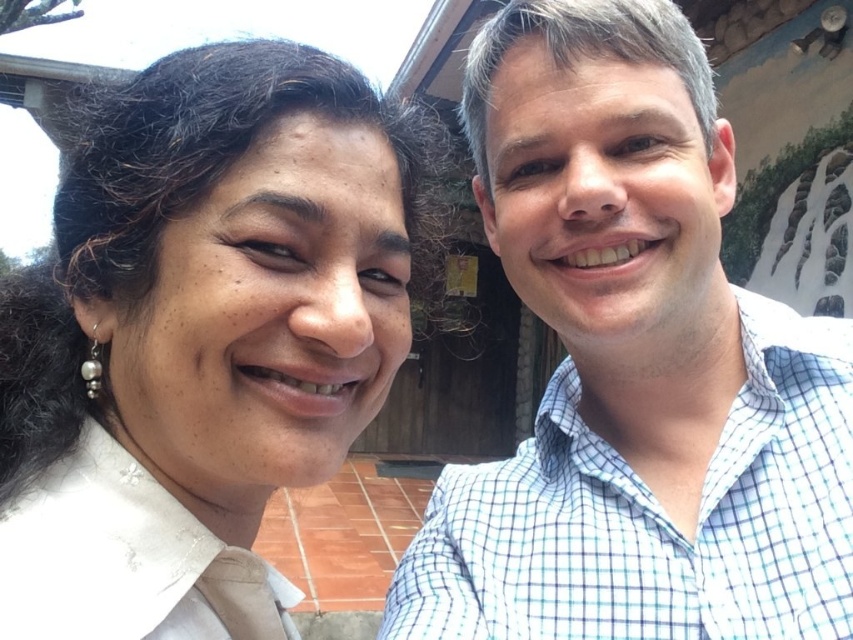
Question: Which point is farther to the camera?

Choices:
 (A) white matte shirt at upper left
 (B) white checkered shirt at right

Answer: (B)

Question: Is white checkered shirt at right positioned behind white matte shirt at upper left?

Choices:
 (A) no
 (B) yes

Answer: (B)

Question: Does white checkered shirt at right appear on the right side of white matte shirt at upper left?

Choices:
 (A) no
 (B) yes

Answer: (B)

Question: Can you confirm if white checkered shirt at right is thinner than white matte shirt at upper left?

Choices:
 (A) yes
 (B) no

Answer: (B)